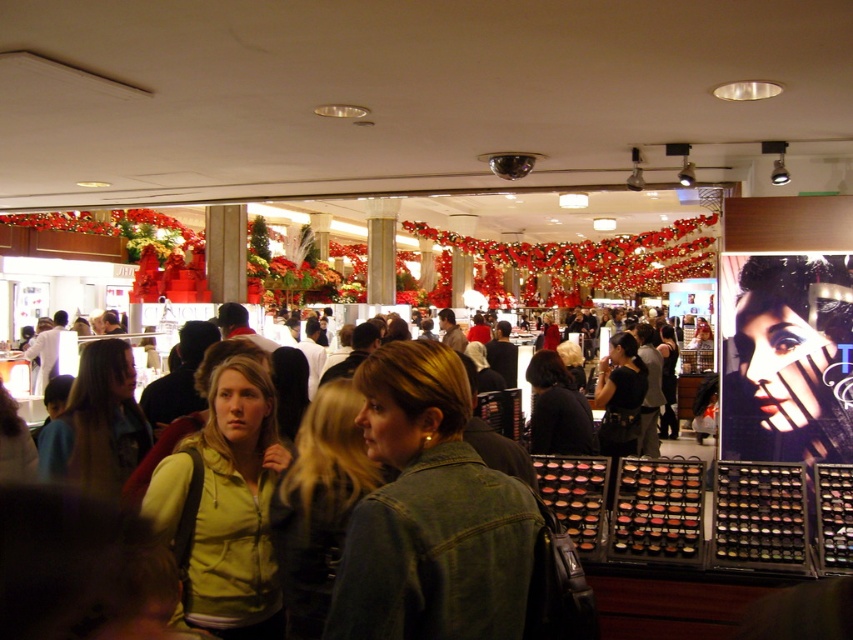
Question: In this image, where is denim jacket at center located relative to matte yellow hoodie at center?

Choices:
 (A) right
 (B) left

Answer: (A)

Question: Is denim jacket at center to the left of matte yellow hoodie at center from the viewer's perspective?

Choices:
 (A) yes
 (B) no

Answer: (B)

Question: Which object appears farthest from the camera in this image?

Choices:
 (A) denim jacket at center
 (B) matte yellow hoodie at center

Answer: (B)

Question: Which of the following is the farthest from the observer?

Choices:
 (A) matte yellow hoodie at center
 (B) denim jacket at center

Answer: (A)

Question: Is denim jacket at center to the right of matte yellow hoodie at center from the viewer's perspective?

Choices:
 (A) no
 (B) yes

Answer: (B)